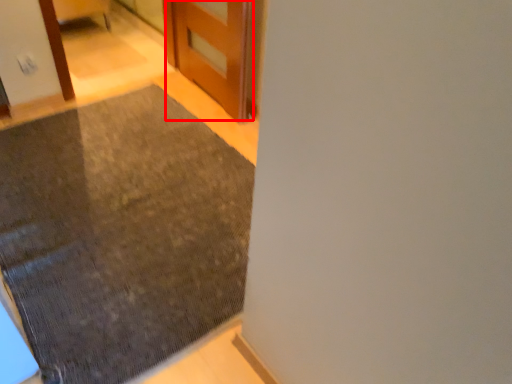
Question: From the image's perspective, where is door (annotated by the red box) located in relation to mat in the image?

Choices:
 (A) above
 (B) below

Answer: (A)